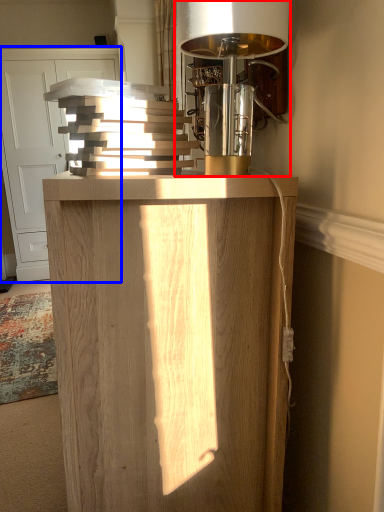
Question: Which object is closer to the camera taking this photo, table lamp (highlighted by a red box) or cabinetry (highlighted by a blue box)?

Choices:
 (A) table lamp
 (B) cabinetry

Answer: (A)